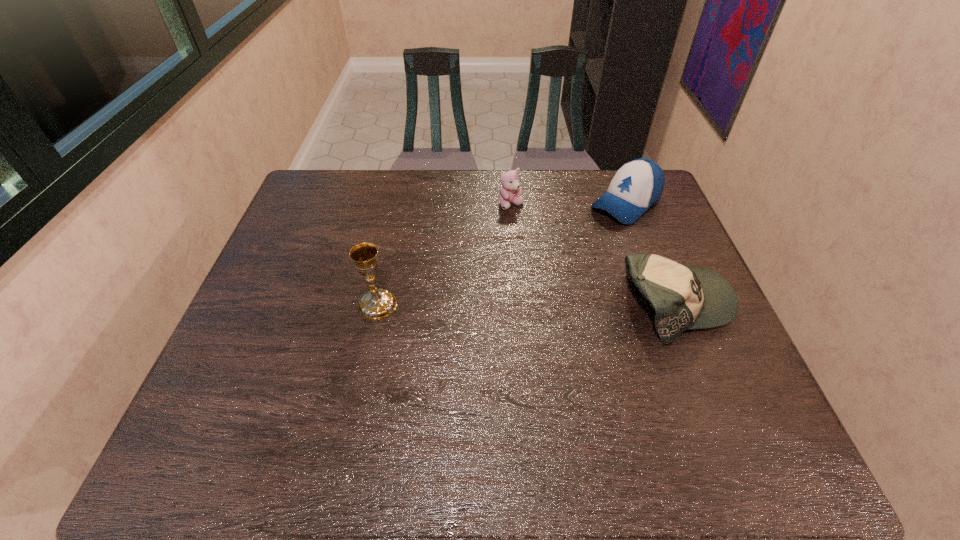
The width and height of the screenshot is (960, 540). I want to click on vacant region that satisfies the following two spatial constraints: 1. on the front side of the shorter baseball cap; 2. on the front-facing side of the second object from left to right, so click(x=519, y=305).

Where is `vacant space that satisfies the following two spatial constraints: 1. on the front side of the nearer baseball cap; 2. on the front-facing side of the farther baseball cap`? This screenshot has width=960, height=540. vacant space that satisfies the following two spatial constraints: 1. on the front side of the nearer baseball cap; 2. on the front-facing side of the farther baseball cap is located at coordinates (664, 305).

The height and width of the screenshot is (540, 960). Identify the location of vacant area that satisfies the following two spatial constraints: 1. on the back side of the teddy bear; 2. on the left side of the farther baseball cap. (511, 204).

Where is `vacant region that satisfies the following two spatial constraints: 1. on the front side of the farther baseball cap; 2. on the front-facing side of the shorter baseball cap`? The image size is (960, 540). vacant region that satisfies the following two spatial constraints: 1. on the front side of the farther baseball cap; 2. on the front-facing side of the shorter baseball cap is located at coordinates (664, 305).

You are a GUI agent. You are given a task and a screenshot of the screen. Output one action in this format:
    pyautogui.click(x=<x>, y=<y>)
    Task: Click on the vacant position in the image that satisfies the following two spatial constraints: 1. on the front side of the shorter baseball cap; 2. on the front-facing side of the second object from left to right
    This screenshot has width=960, height=540.
    Given the screenshot: What is the action you would take?
    pyautogui.click(x=519, y=305)

This screenshot has width=960, height=540. I want to click on vacant space that satisfies the following two spatial constraints: 1. on the front side of the farther baseball cap; 2. on the front-facing side of the shorter baseball cap, so click(664, 305).